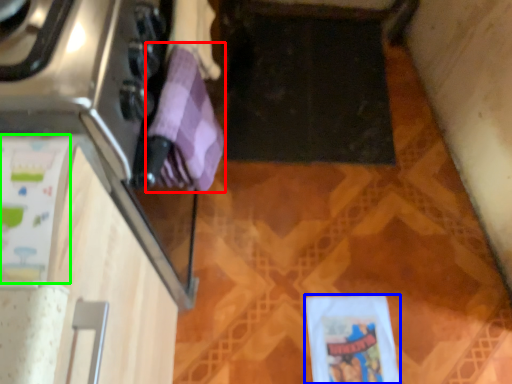
Question: Which object is the farthest from wrapping paper (highlighted by a red box)? Choose among these: wrapping paper (highlighted by a blue box) or wrapping paper (highlighted by a green box).

Choices:
 (A) wrapping paper
 (B) wrapping paper

Answer: (A)